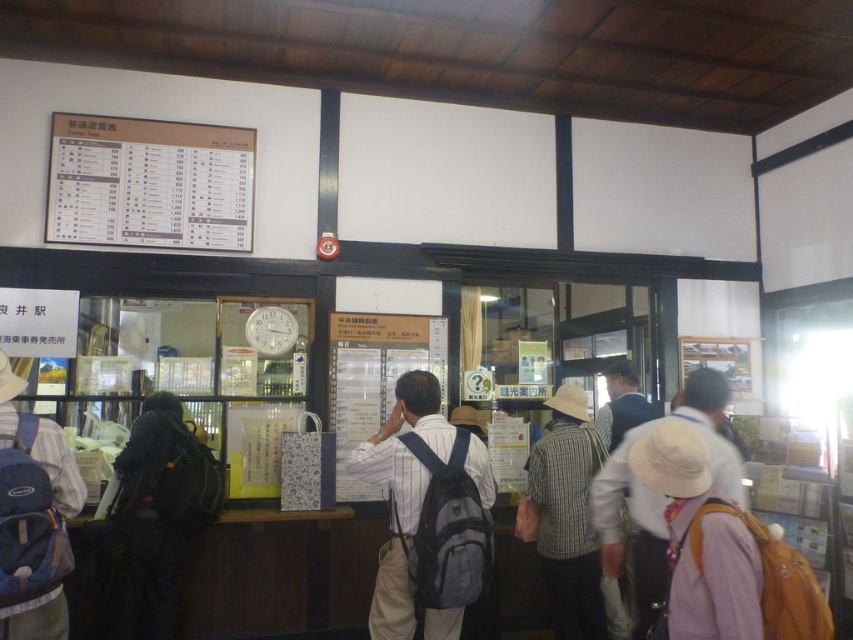
Question: Which object is farther from the camera taking this photo?

Choices:
 (A) plaid fabric shirt at center
 (B) dark blue backpack at left
 (C) blue backpack at left

Answer: (A)

Question: Which object appears closest to the camera in this image?

Choices:
 (A) blue backpack at left
 (B) dark blue backpack at left
 (C) plaid fabric shirt at center

Answer: (A)

Question: Considering the relative positions of matte paperboard at upper left and blue backpack at left in the image provided, where is matte paperboard at upper left located with respect to blue backpack at left?

Choices:
 (A) above
 (B) below

Answer: (A)

Question: Can you confirm if plaid fabric shirt at center is positioned to the left of white fabric hat at center?

Choices:
 (A) yes
 (B) no

Answer: (A)

Question: Does matte paperboard at upper left appear on the left side of dark blue backpack at left?

Choices:
 (A) yes
 (B) no

Answer: (A)

Question: Which of these objects is positioned farthest from the plaid fabric shirt at center?

Choices:
 (A) matte gray backpack at center
 (B) dark blue backpack at left
 (C) blue backpack at left
 (D) matte paperboard at upper left

Answer: (D)